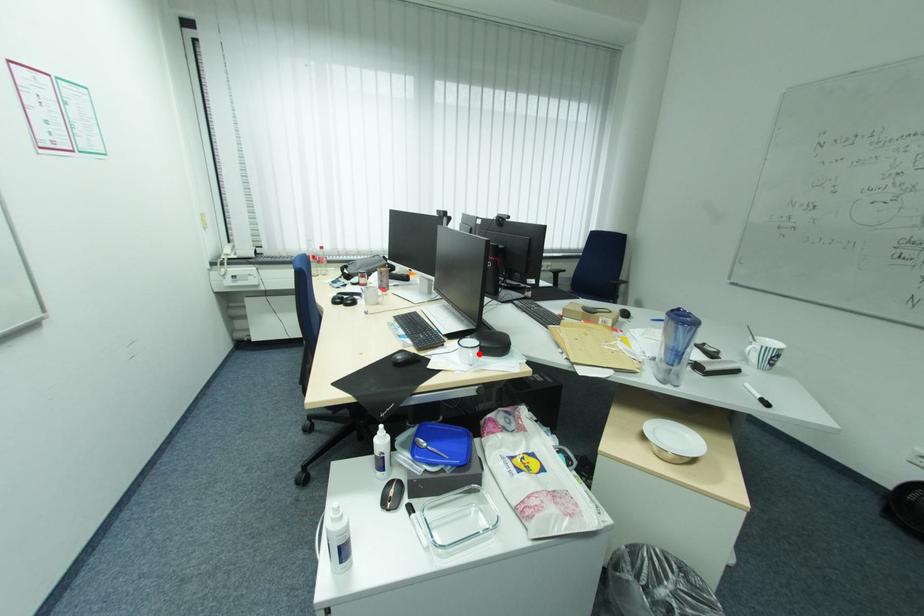
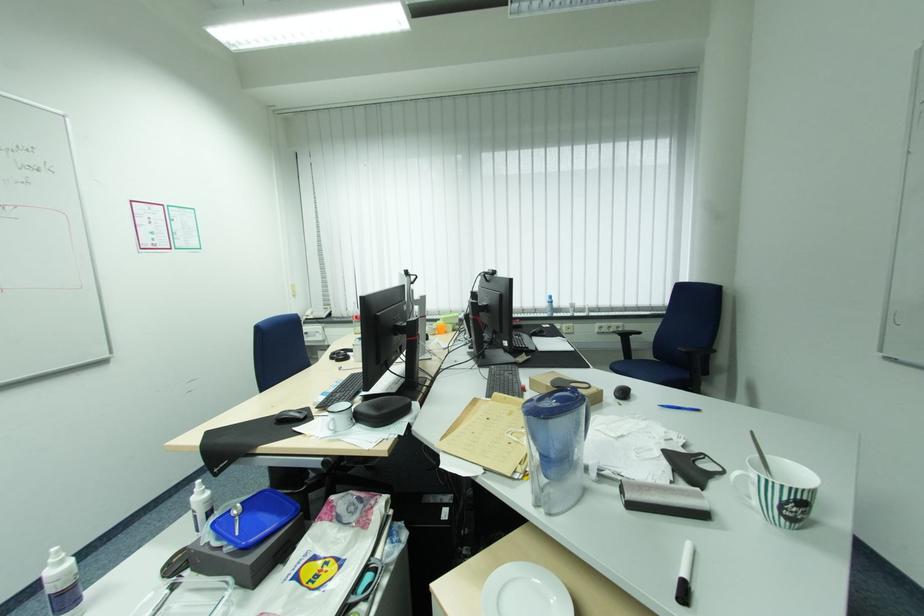
Question: I am providing you with two images of the same scene from different viewpoints. A red point is marked on the first image. At the location where the point appears in image 1, is it still visible in image 2?

Choices:
 (A) Yes
 (B) No

Answer: (A)